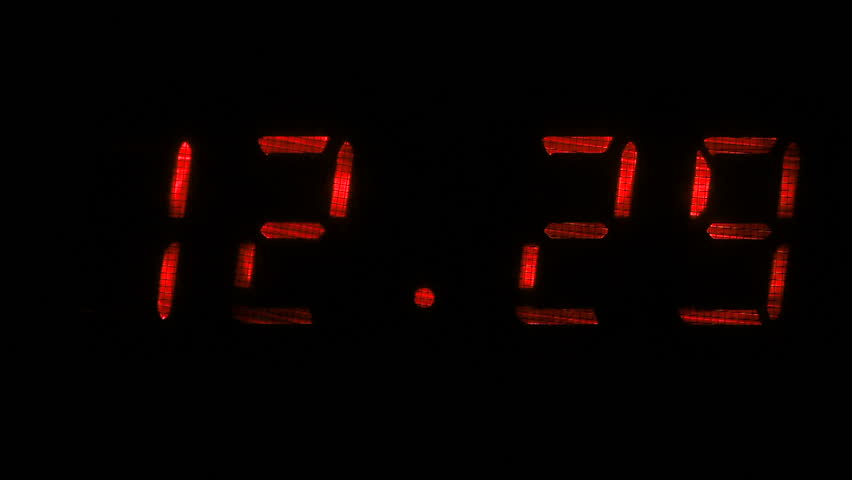
The image size is (852, 480). What are the coordinates of `display area` in the screenshot? It's located at (540, 103).